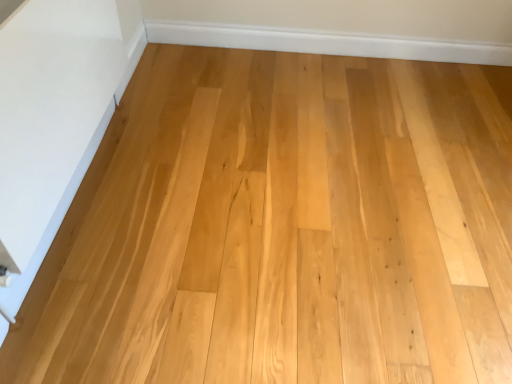
At what (x,y) coordinates should I click in order to perform the action: click on free spot in front of natural wood floor at upper center. Please return your answer as a coordinate pair (x, y). The height and width of the screenshot is (384, 512). Looking at the image, I should click on pos(289,211).